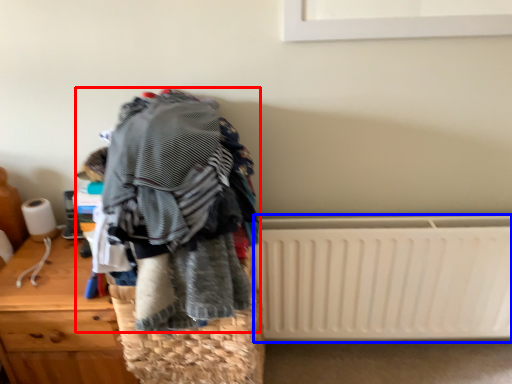
Question: Among these objects, which one is farthest to the camera, textile (highlighted by a red box) or radiator (highlighted by a blue box)?

Choices:
 (A) textile
 (B) radiator

Answer: (B)